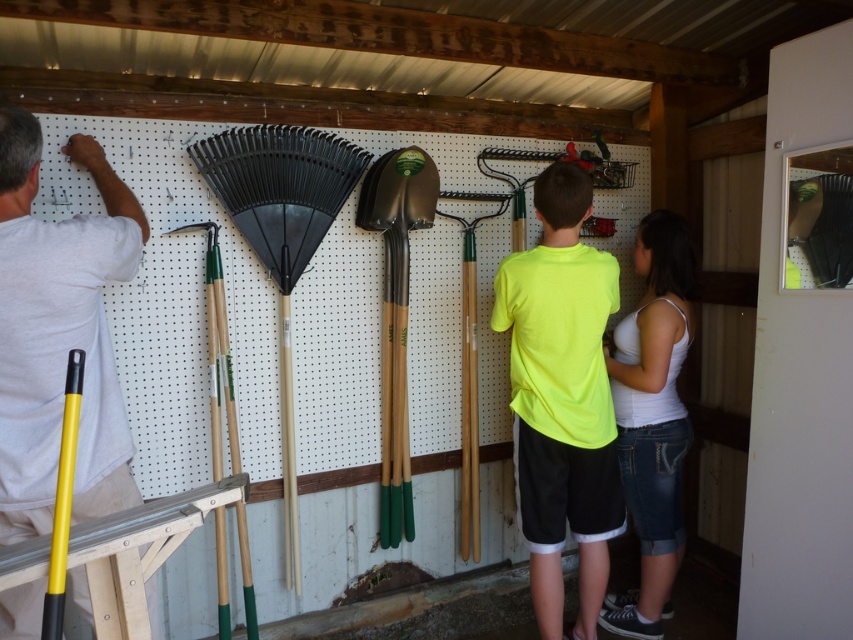
Consider the image. You are standing in front of the pegboard wall in the workshop. There are two points marked on the wall at coordinates point (1, 342) and point (396, 161). Which point is closer to your eyes?

Point (1, 342) is closer to the camera than point (396, 161), so the point closer to your eyes is point (1, 342).